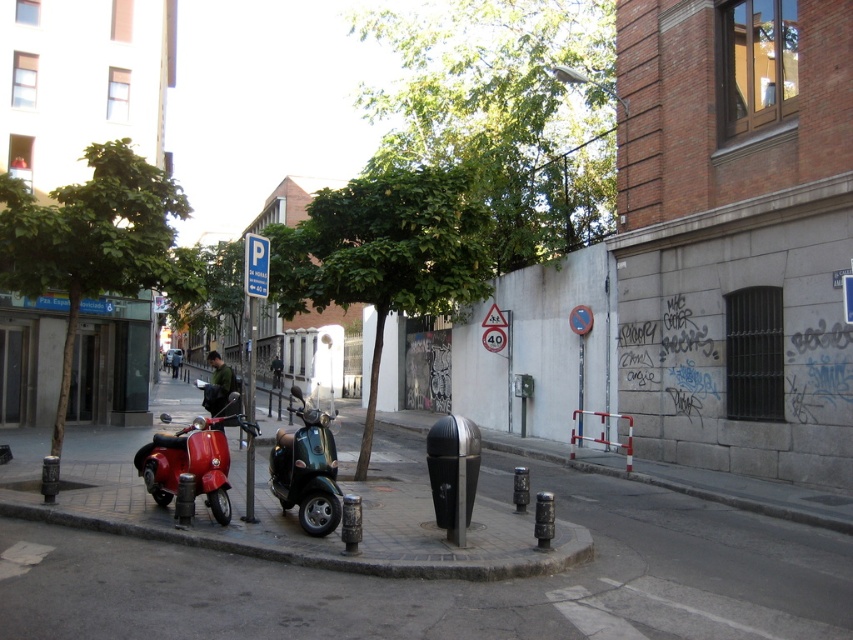
You are a delivery person needing to park your scooter in this area. You see the shiny red scooter at lower left and the green leafy tree at center. Which object is closer to you from your perspective?

The green leafy tree at center is closer to you because the shiny red scooter at lower left is behind it.

You are standing on the sidewalk and want to walk towards the smooth concrete pavement at center. However, there is a metallic green scooter at center in your path. Can you walk around it without stepping onto the road?

The smooth concrete pavement at center is closer to the viewer than the metallic green scooter at center, so the scooter is behind the pavement. Since the pavement is already in front of you, you can walk around the metallic green scooter at center by stepping onto the sidewalk next to it without needing to go onto the road.